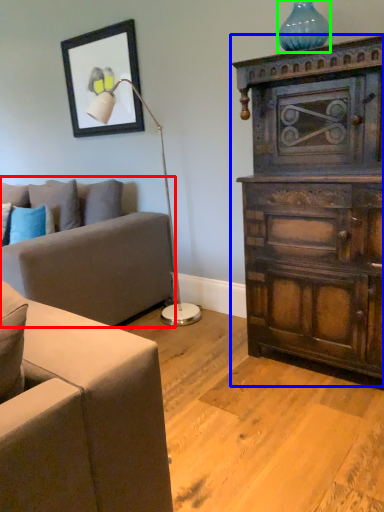
Question: Which is nearer to the studio couch (highlighted by a red box)? chest of drawers (highlighted by a blue box) or vase (highlighted by a green box).

Choices:
 (A) chest of drawers
 (B) vase

Answer: (A)